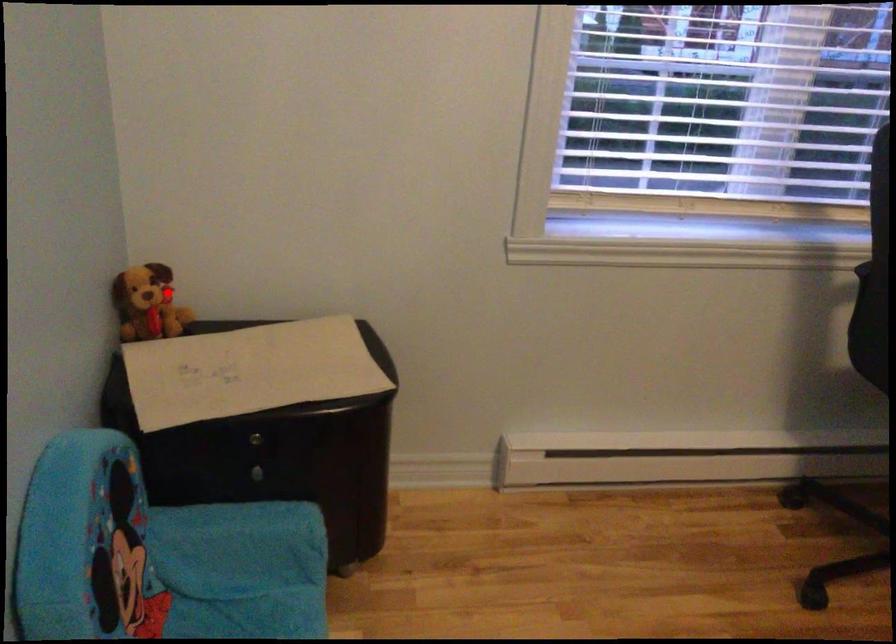
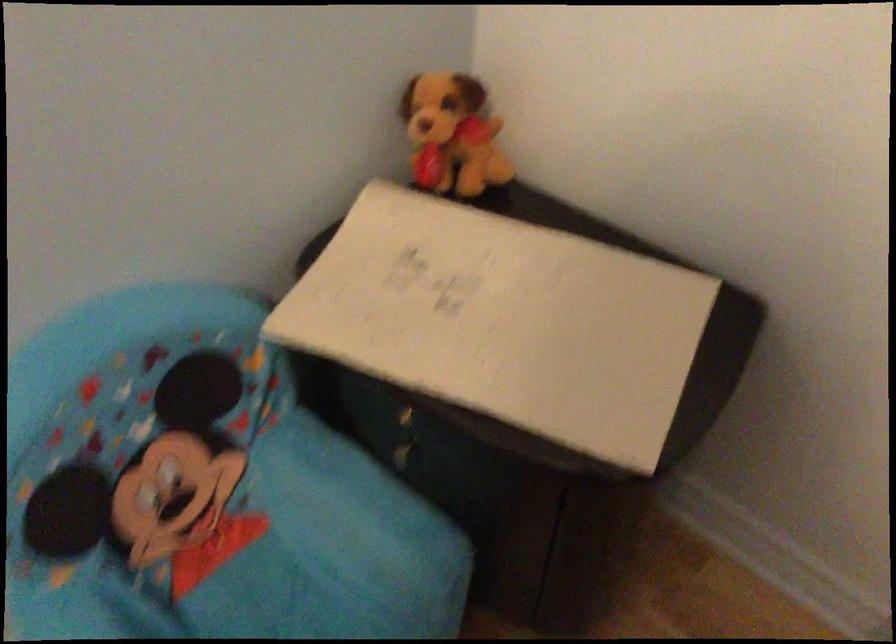
Where in the second image is the point corresponding to the highlighted location from the first image?

(452, 134)